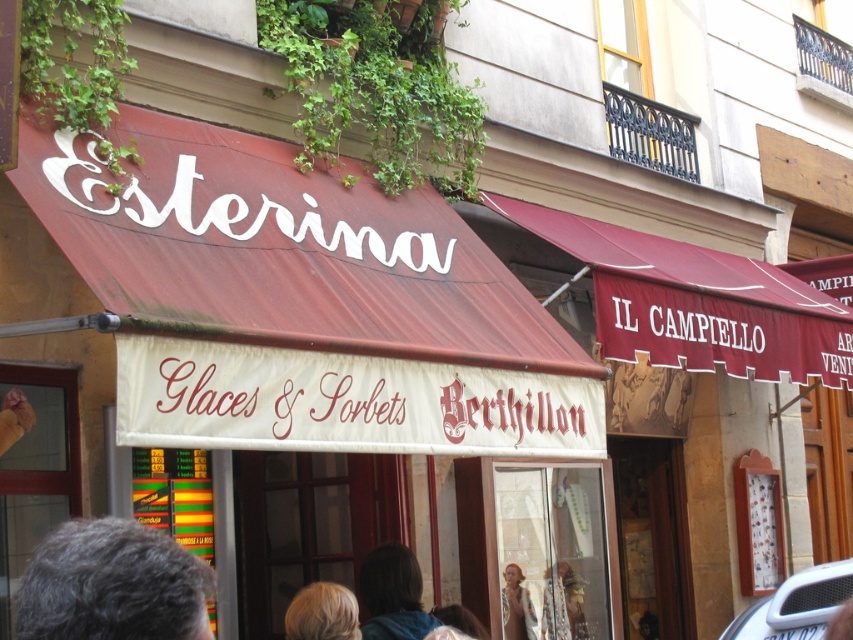
You are standing in front of the two storefronts and want to take a photo. You notice two points marked on the left storefront at coordinates point (321, 618) and point (503, 625). Which point should you focus on to ensure it appears closer in your photo?

You should focus on point (321, 618) because it is closer to the camera than point (503, 625).

Looking at this image, you are standing in front of the storefronts and want to pick up the white plastic car at lower right and the multicolored fabric at lower center. Which object should you bend down to reach first?

The white plastic car at lower right is closer to the viewer than the multicolored fabric at lower center, so you should bend down to reach the white plastic car at lower right first.